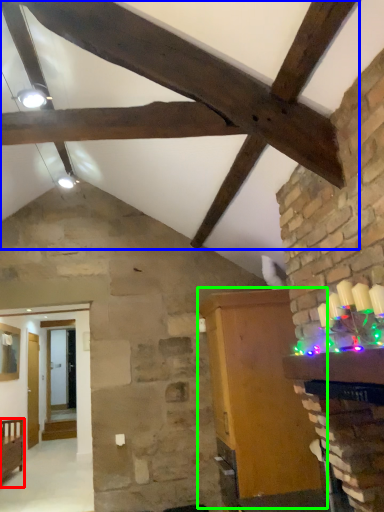
Question: Estimate the real-world distances between objects in this image. Which object is farther from furniture (highlighted by a red box), exhaust hood (highlighted by a blue box) or furniture (highlighted by a green box)?

Choices:
 (A) exhaust hood
 (B) furniture

Answer: (A)